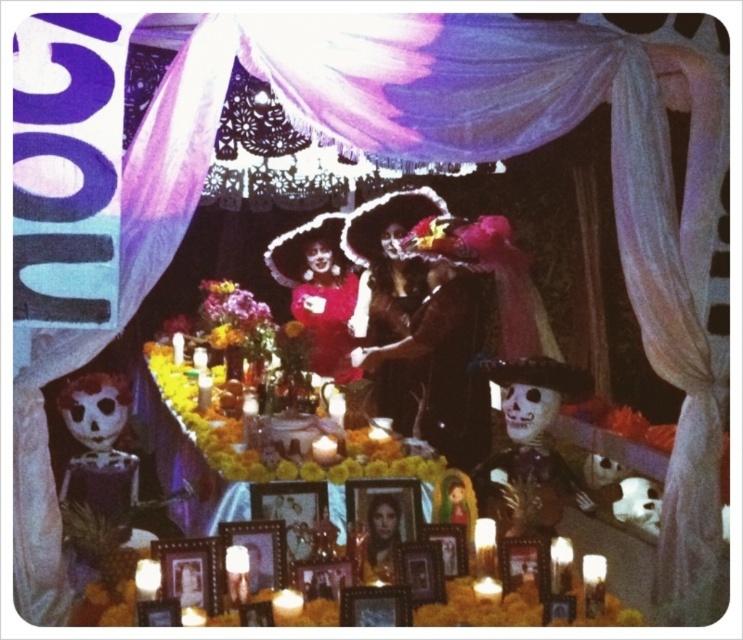
Does matte black dress at center have a greater width compared to smooth skin portrait at center?

Yes, matte black dress at center is wider than smooth skin portrait at center.

Which is above, matte black dress at center or smooth skin portrait at center?

matte black dress at center

Describe the element at coordinates (424, 328) in the screenshot. This screenshot has height=640, width=743. I see `matte black dress at center` at that location.

This screenshot has height=640, width=743. What are the coordinates of `matte black dress at center` in the screenshot? It's located at (424, 328).

Between vibrant floral bouquet at center and smooth skin portrait at center, which one is positioned higher?

vibrant floral bouquet at center is higher up.

Does vibrant floral bouquet at center appear on the right side of smooth skin portrait at center?

No, vibrant floral bouquet at center is not to the right of smooth skin portrait at center.

At what (x,y) coordinates should I click in order to perform the action: click on vibrant floral bouquet at center. Please return your answer as a coordinate pair (x, y). Looking at the image, I should click on (230, 307).

Does pink satin dress at center have a smaller size compared to vibrant floral bouquet at center?

No.

Can you confirm if pink satin dress at center is positioned above vibrant floral bouquet at center?

Yes.

Where is `pink satin dress at center`? pink satin dress at center is located at coordinates (324, 298).